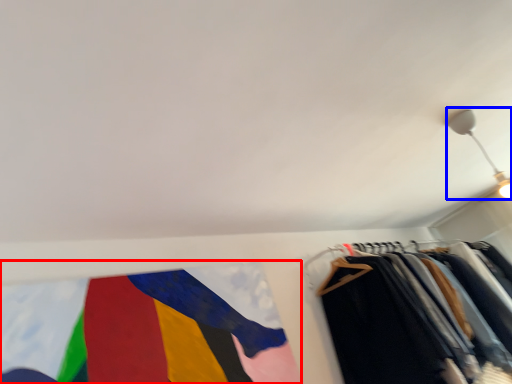
Question: Which object appears closest to the camera in this image, flag (highlighted by a red box) or light fixture (highlighted by a blue box)?

Choices:
 (A) flag
 (B) light fixture

Answer: (A)